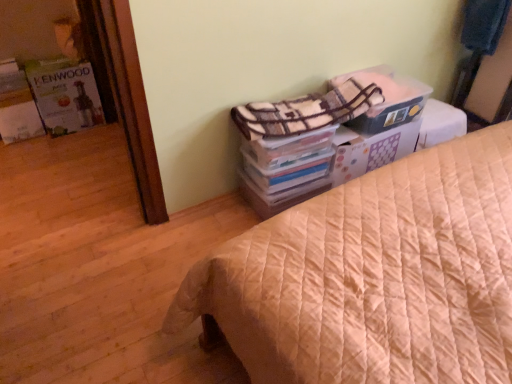
Question: Should I look upward or downward to see beige quilted bed at center?

Choices:
 (A) up
 (B) down

Answer: (B)

Question: Could you tell me if white cardboard box at upper right is turned towards plaid fabric blanket at upper right, acting as the first blanket starting from the back?

Choices:
 (A) yes
 (B) no

Answer: (B)

Question: Is plaid fabric blanket at upper right, acting as the second blanket starting from the bottom, inside white cardboard box at upper right?

Choices:
 (A) yes
 (B) no

Answer: (B)

Question: Can you confirm if white cardboard box at upper right is positioned to the left of plaid fabric blanket at upper right, the first blanket when ordered from right to left?

Choices:
 (A) yes
 (B) no

Answer: (A)

Question: Is white cardboard box at upper right taller than plaid fabric blanket at upper right, which appears as the second blanket when viewed from the left?

Choices:
 (A) yes
 (B) no

Answer: (B)

Question: Can you confirm if white cardboard box at upper right is shorter than plaid fabric blanket at upper right, which appears as the second blanket when viewed from the left?

Choices:
 (A) no
 (B) yes

Answer: (B)

Question: From the image's perspective, does white cardboard box at upper right appear lower than plaid fabric blanket at upper right, acting as the second blanket starting from the bottom?

Choices:
 (A) no
 (B) yes

Answer: (B)

Question: From a real-world perspective, is matte white kenwood appliance at left physically above white cardboard box at upper right?

Choices:
 (A) no
 (B) yes

Answer: (A)

Question: Can you confirm if matte white kenwood appliance at left is bigger than white cardboard box at upper right?

Choices:
 (A) yes
 (B) no

Answer: (A)

Question: From the image's perspective, would you say matte white kenwood appliance at left is shown under white cardboard box at upper right?

Choices:
 (A) no
 (B) yes

Answer: (A)

Question: Considering the relative sizes of matte white kenwood appliance at left and white cardboard box at upper right in the image provided, is matte white kenwood appliance at left wider than white cardboard box at upper right?

Choices:
 (A) yes
 (B) no

Answer: (B)

Question: Is the depth of matte white kenwood appliance at left less than that of white cardboard box at upper right?

Choices:
 (A) yes
 (B) no

Answer: (B)

Question: Considering the relative sizes of matte white kenwood appliance at left and white cardboard box at upper right in the image provided, is matte white kenwood appliance at left smaller than white cardboard box at upper right?

Choices:
 (A) no
 (B) yes

Answer: (A)

Question: From a real-world perspective, is plaid fabric blanket at upper right, marked as the 1th blanket in a left-to-right arrangement, below white cardboard box at upper right?

Choices:
 (A) no
 (B) yes

Answer: (A)